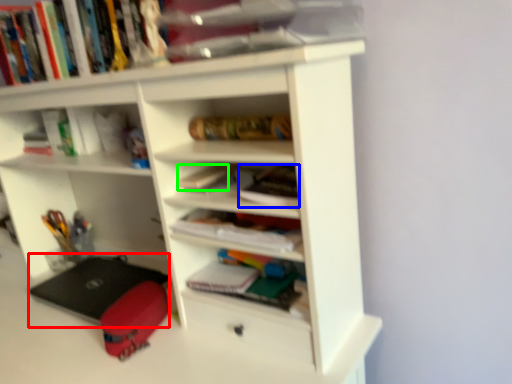
Question: Considering the real-world distances, which object is closest to laptop (highlighted by a red box)? book (highlighted by a blue box) or book (highlighted by a green box).

Choices:
 (A) book
 (B) book

Answer: (B)